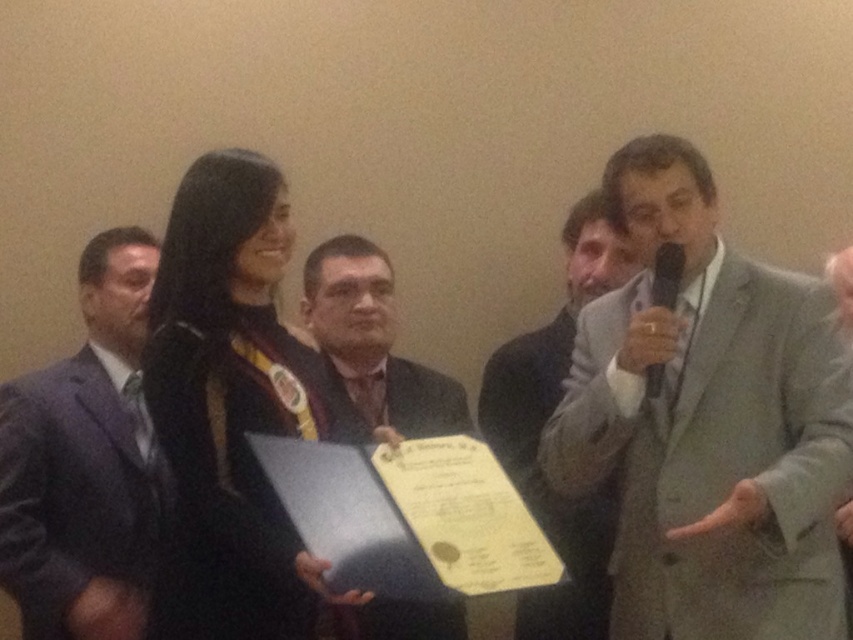
You are a photographer at the event and need to capture a photo of the matte black suit at center and the black plastic microphone at upper right. Which object is taller in the image?

The matte black suit at center is taller than the black plastic microphone at upper right.

You are organizing a formal event and need to seat two guests based on their attire. The dark gray suit at left and the black satin business suit at center are present. Which guest should you seat in a wider seat to accommodate their outfit?

The black satin business suit at center requires a wider seat since it has a greater width compared to the dark gray suit at left.

You are an event planner organizing a photo shoot for the ceremony. You need to position a spotlight on the matte black suit at center and the matte black microphone at right. Since the spotlight can only illuminate one object at a time, which object should you aim it at first if you want to follow the natural left to right viewing direction?

The matte black suit at center should be illuminated first because it is positioned to the left of the matte black microphone at right, and following the natural left to right viewing direction means starting with the object on the left.